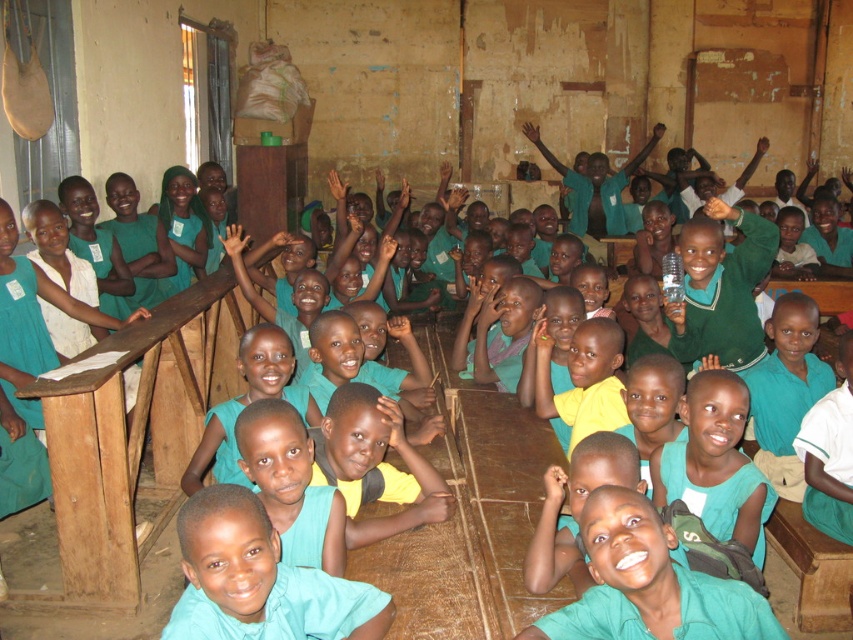
You are a teacher in the classroom and want to see which hand is closer to the floor between the dark brown wood hand at lower center and the dark skin hand at lower center. Which hand is lower?

The dark brown wood hand at lower center is below the dark skin hand at lower center, so the dark brown wood hand at lower center is closer to the floor.

From the picture: You are a teacher in the classroom and want to give a sticker to the child with the yellow matte shirt at center and the dark brown wood hand at lower center. The sticker is only big enough to fit on the smaller object. Which object should you place the sticker on?

The dark brown wood hand at lower center is smaller than the yellow matte shirt at center, so you should place the sticker on the dark brown wood hand at lower center.

What is the 2D coordinate of the dark brown wood hand at lower center in the classroom scene?

The dark brown wood hand at lower center is located at the 2D coordinate point of (431, 508).